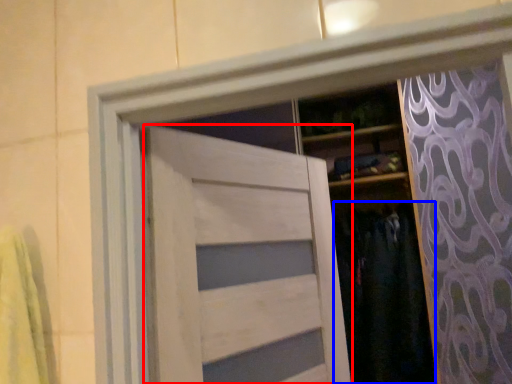
Question: Among these objects, which one is farthest to the camera, door (highlighted by a red box) or clothing (highlighted by a blue box)?

Choices:
 (A) door
 (B) clothing

Answer: (B)